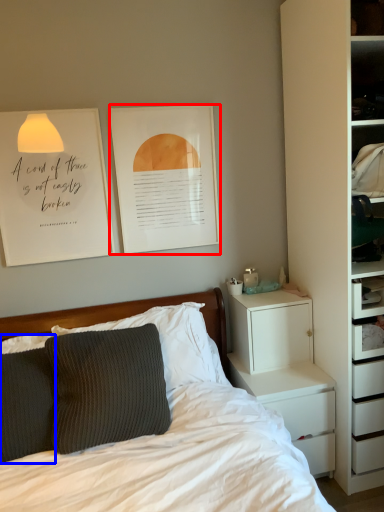
Question: Which object is further to the camera taking this photo, picture frame (highlighted by a red box) or pillow (highlighted by a blue box)?

Choices:
 (A) picture frame
 (B) pillow

Answer: (A)